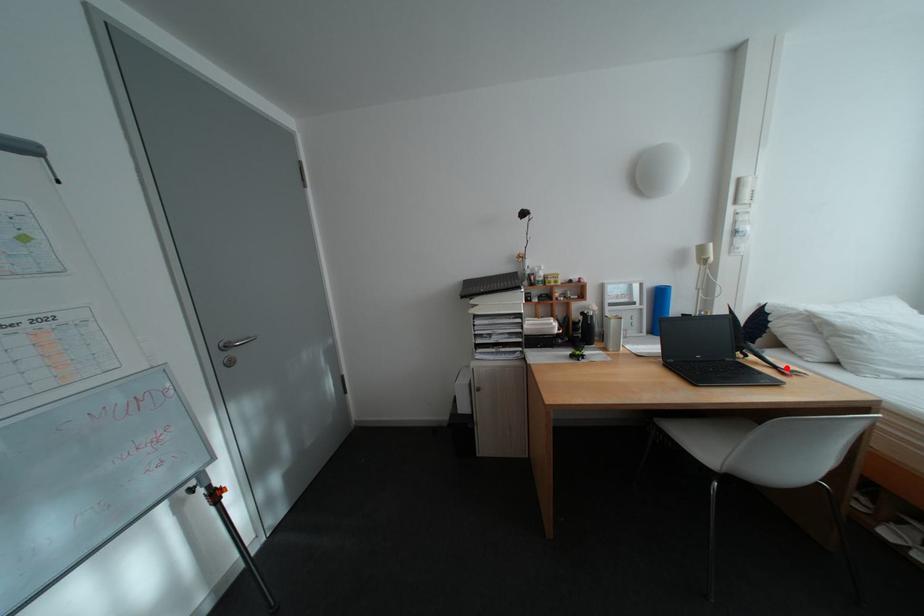
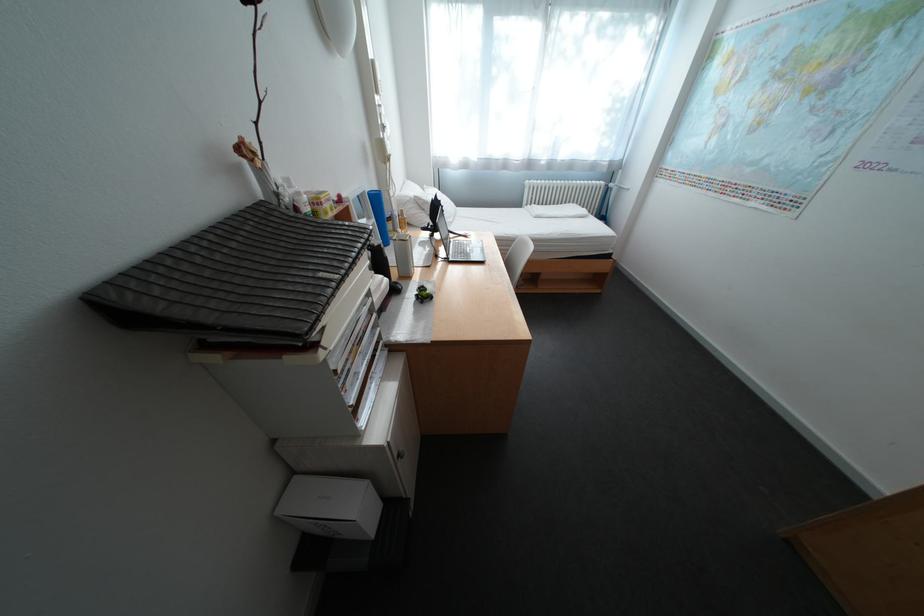
Find the pixel in the second image that matches the highlighted location in the first image.

(472, 236)